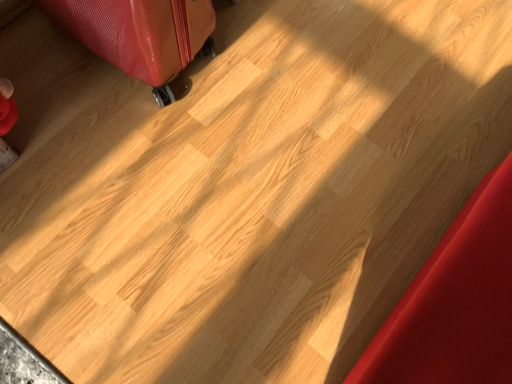
What do you see at coordinates (140, 34) in the screenshot? This screenshot has width=512, height=384. I see `rubberized red suitcase at upper left` at bounding box center [140, 34].

What are the coordinates of `rubberized red suitcase at upper left` in the screenshot? It's located at [140, 34].

Measure the distance between rubberized red suitcase at upper left and camera.

rubberized red suitcase at upper left and camera are 32.17 inches apart.

Identify the location of rubberized red suitcase at upper left. (140, 34).